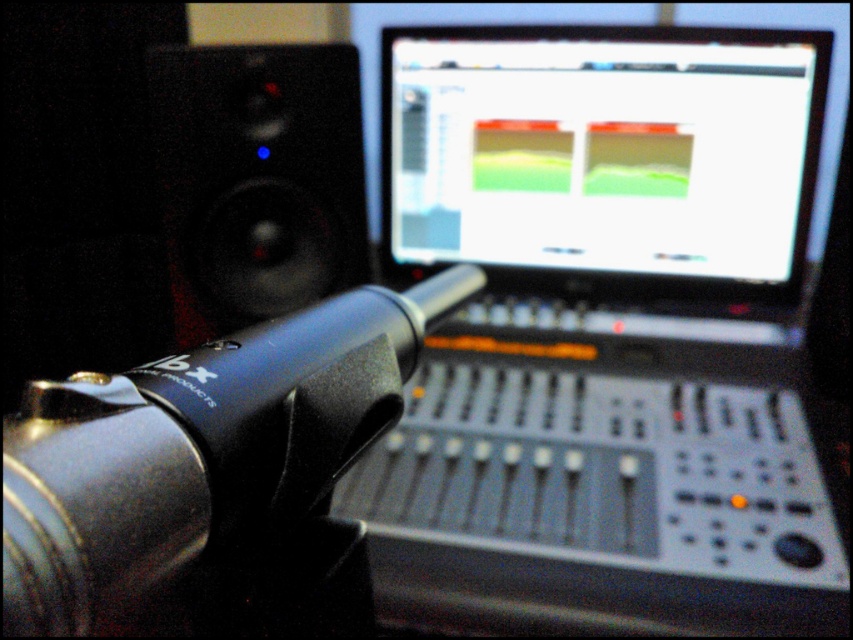
Can you confirm if matte plastic screen at upper center is positioned to the right of black matte speaker at left?

Indeed, matte plastic screen at upper center is positioned on the right side of black matte speaker at left.

Does matte plastic screen at upper center have a greater height compared to black matte speaker at left?

Incorrect, matte plastic screen at upper center's height is not larger of black matte speaker at left's.

Locate an element on the screen. The height and width of the screenshot is (640, 853). matte plastic screen at upper center is located at coordinates (602, 148).

Which is more to the left, black matte microphone at center-left or black matte speaker at left?

Positioned to the left is black matte speaker at left.

Can you confirm if black matte microphone at center-left is positioned below black matte speaker at left?

Yes.

Who is more distant from viewer, [9,611] or [265,236]?

The point [265,236] is more distant.

I want to click on black matte microphone at center-left, so click(196, 451).

Does matte plastic screen at upper center come behind black matte microphone at center-left?

Yes, matte plastic screen at upper center is further from the viewer.

You are a GUI agent. You are given a task and a screenshot of the screen. Output one action in this format:
    pyautogui.click(x=<x>, y=<y>)
    Task: Click on the matte plastic screen at upper center
    Image resolution: width=853 pixels, height=640 pixels.
    Given the screenshot: What is the action you would take?
    pyautogui.click(x=602, y=148)